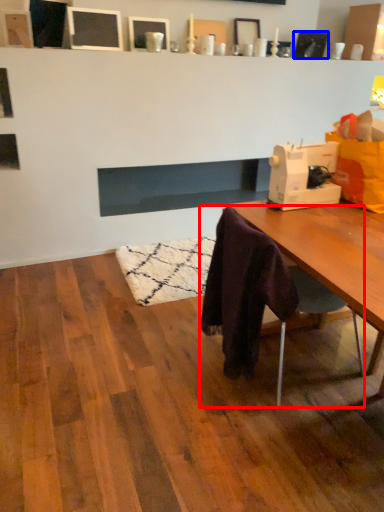
Question: Which object appears farthest to the camera in this image, chair (highlighted by a red box) or picture frame (highlighted by a blue box)?

Choices:
 (A) chair
 (B) picture frame

Answer: (B)